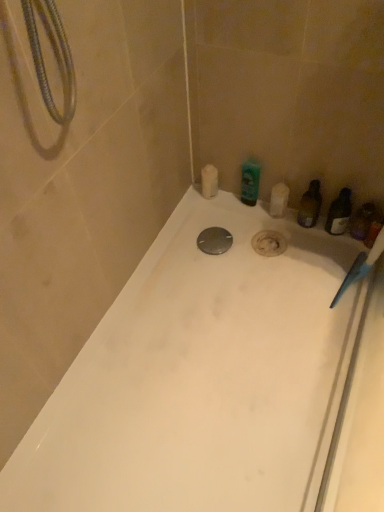
Find the location of a particular element. The image size is (384, 512). vacant space that is in between translucent plastic bottle at right, placed as the 1th toiletry when sorted from right to left, and metallic silver drain at center is located at coordinates (271, 245).